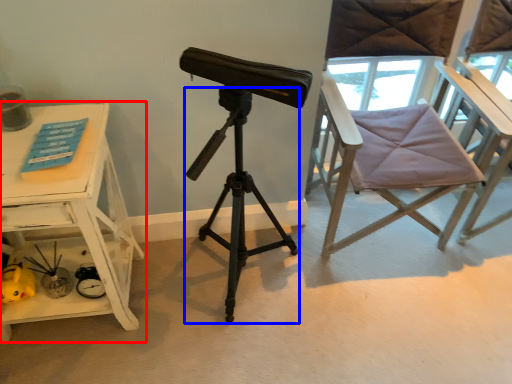
Question: Which point is further to the camera, table (highlighted by a red box) or tripod (highlighted by a blue box)?

Choices:
 (A) table
 (B) tripod

Answer: (A)